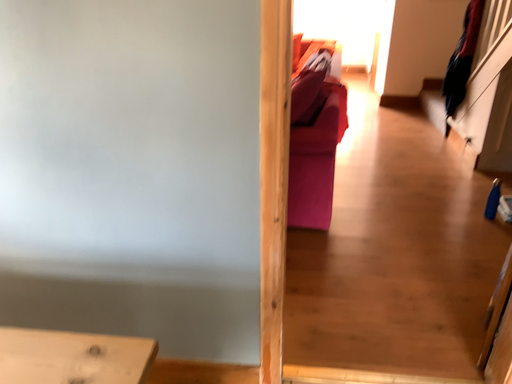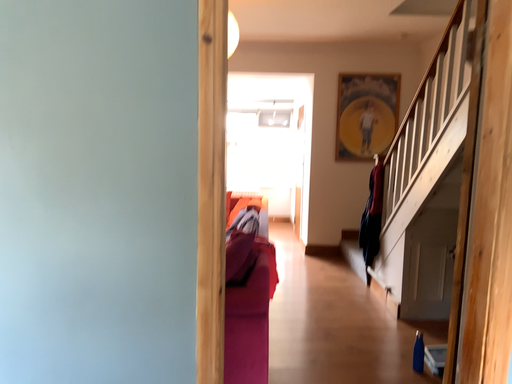
Question: How did the camera likely rotate when shooting the video?

Choices:
 (A) rotated downward
 (B) rotated upward

Answer: (B)